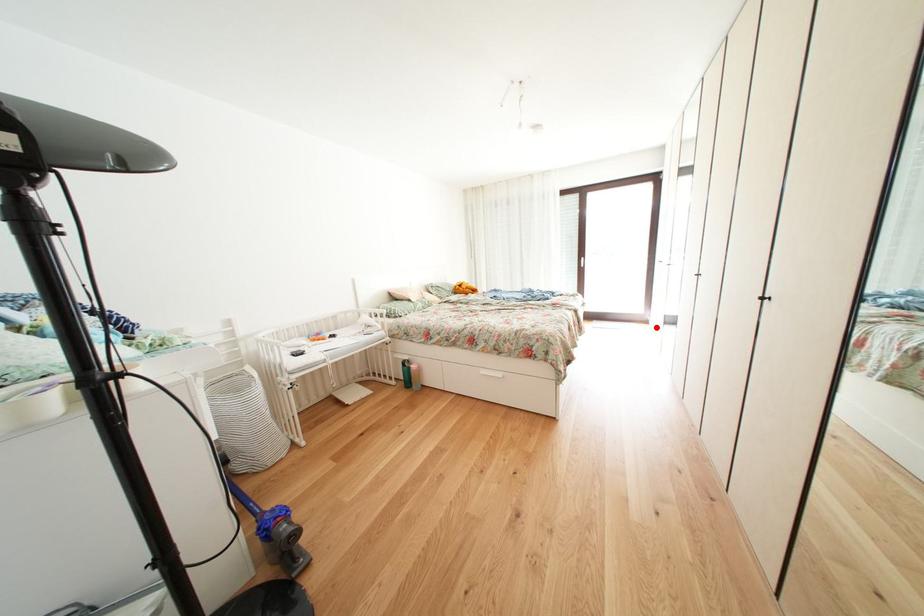
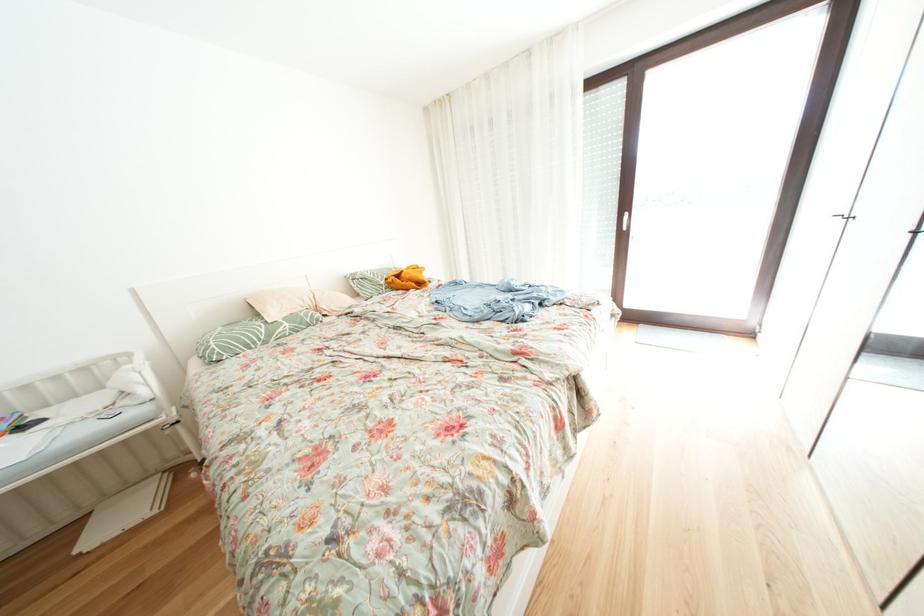
Question: I am providing you with two images of the same scene from different viewpoints. Given a red point in image1, look at the same physical point in image2. Is it:

Choices:
 (A) Closer to the viewpoint
 (B) Farther from the viewpoint

Answer: (A)